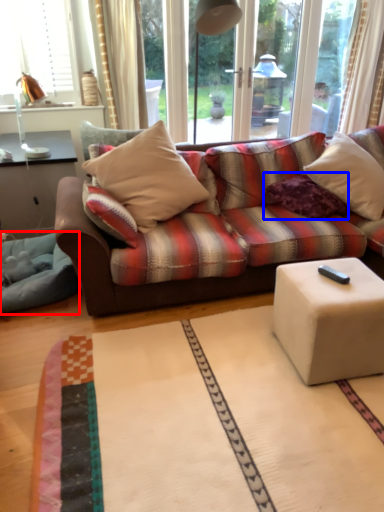
Question: Which point is closer to the camera, blanket (highlighted by a red box) or pillow (highlighted by a blue box)?

Choices:
 (A) blanket
 (B) pillow

Answer: (A)